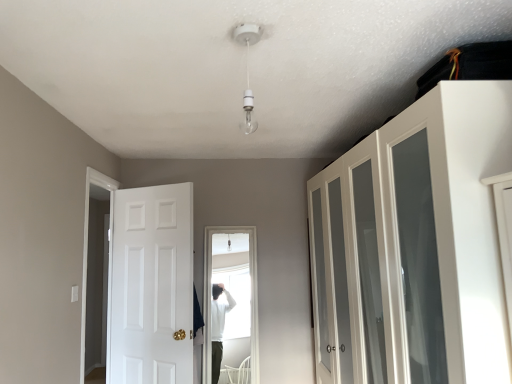
Question: Considering the relative sizes of white glossy door at left and white glass cabinet at upper right in the image provided, is white glossy door at left shorter than white glass cabinet at upper right?

Choices:
 (A) yes
 (B) no

Answer: (A)

Question: From a real-world perspective, is white glossy door at left below white glass cabinet at upper right?

Choices:
 (A) no
 (B) yes

Answer: (A)

Question: Is white glossy door at left thinner than white glass cabinet at upper right?

Choices:
 (A) yes
 (B) no

Answer: (A)

Question: From the image's perspective, does white glossy door at left appear lower than white glass cabinet at upper right?

Choices:
 (A) yes
 (B) no

Answer: (A)

Question: From a real-world perspective, is white glossy door at left on top of white glass cabinet at upper right?

Choices:
 (A) yes
 (B) no

Answer: (A)

Question: Is white glossy door at left to the left of white glass cabinet at upper right from the viewer's perspective?

Choices:
 (A) no
 (B) yes

Answer: (B)

Question: Considering the relative sizes of white glass cabinet at upper right and white glossy door at left in the image provided, is white glass cabinet at upper right thinner than white glossy door at left?

Choices:
 (A) no
 (B) yes

Answer: (A)

Question: From the image's perspective, is white glass cabinet at upper right below white glossy door at left?

Choices:
 (A) yes
 (B) no

Answer: (B)

Question: Are white glass cabinet at upper right and white glossy door at left making contact?

Choices:
 (A) no
 (B) yes

Answer: (A)

Question: Is white glass cabinet at upper right taller than white glossy door at left?

Choices:
 (A) yes
 (B) no

Answer: (A)

Question: Is the position of white glass cabinet at upper right more distant than that of white glossy door at left?

Choices:
 (A) no
 (B) yes

Answer: (A)

Question: Could white glossy door at left be considered to be inside white glass cabinet at upper right?

Choices:
 (A) yes
 (B) no

Answer: (B)

Question: Is point (185, 345) closer or farther from the camera than point (479, 142)?

Choices:
 (A) farther
 (B) closer

Answer: (A)